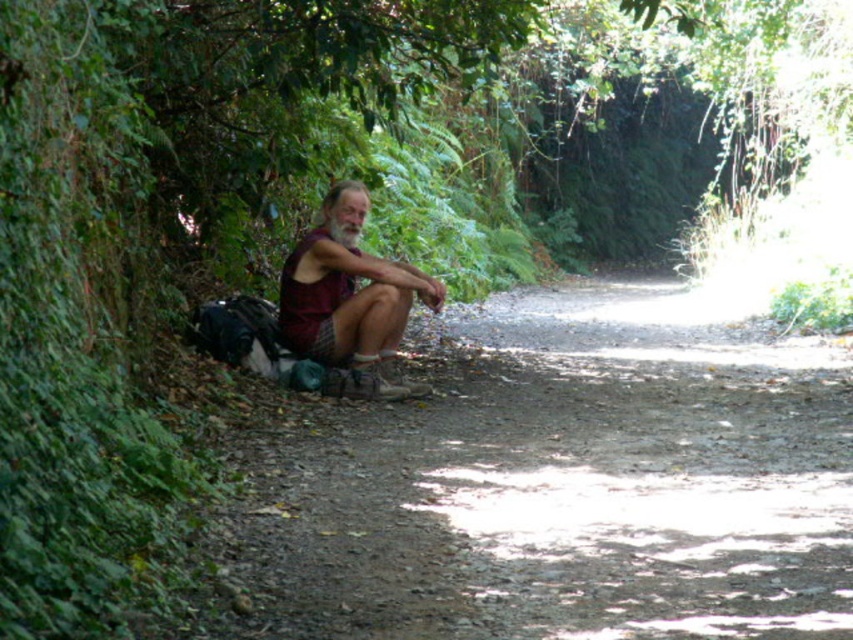
You are a hiker who wants to know if the dirt path at left is higher or lower than the maroon fabric shirt at center. Based on the scene, which one is higher?

The maroon fabric shirt at center is higher than the dirt path at left because the dirt path at left has a lesser height compared to maroon fabric shirt at center.

You are a hiker who wants to place a small backpack on the dirt path at left without it being under the maroon fabric shirt at center. Where should you move the backpack?

The dirt path at left is positioned under the maroon fabric shirt at center, so to avoid placing the backpack under the shirt, move it to a different location on the dirt path at left that is not beneath the maroon fabric shirt at center.